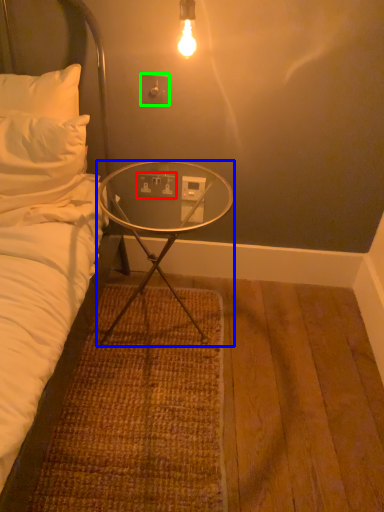
Question: Considering the real-world distances, which object is closest to electric outlet (highlighted by a red box)? desk (highlighted by a blue box) or electric outlet (highlighted by a green box).

Choices:
 (A) desk
 (B) electric outlet

Answer: (A)